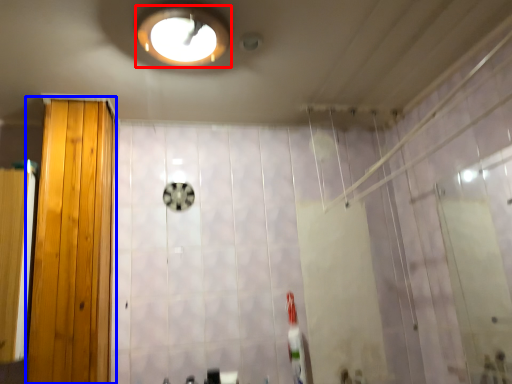
Question: Which object appears closest to the camera in this image, light fixture (highlighted by a red box) or door (highlighted by a blue box)?

Choices:
 (A) light fixture
 (B) door

Answer: (A)